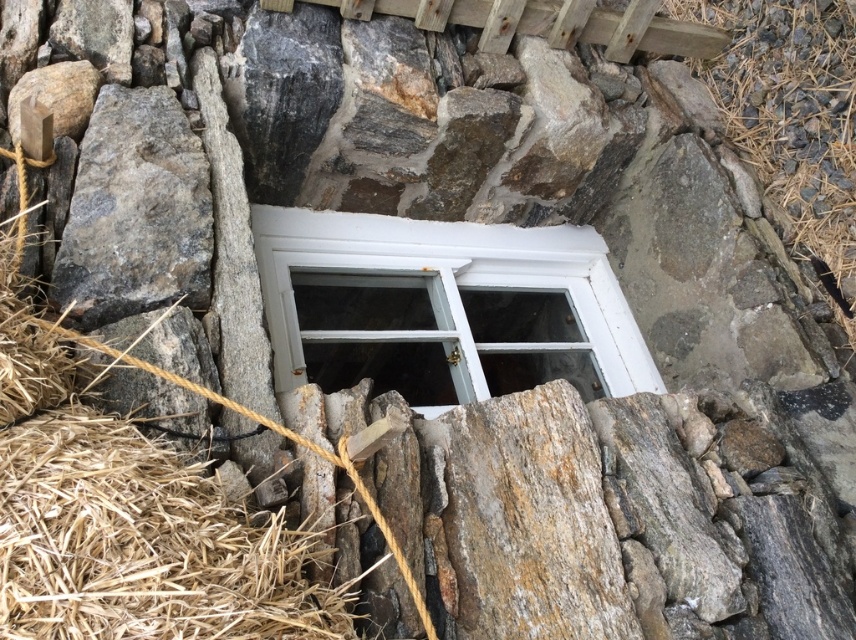
Question: Is brown straw at lower left further to camera compared to gray rough stone at left?

Choices:
 (A) yes
 (B) no

Answer: (B)

Question: Which of the following is the farthest from the observer?

Choices:
 (A) white painted wood window at center
 (B) brown straw at lower left

Answer: (A)

Question: Does brown straw at lower left appear under gray rough stone at left?

Choices:
 (A) no
 (B) yes

Answer: (B)

Question: Is white painted wood window at center bigger than gray rough stone at left?

Choices:
 (A) no
 (B) yes

Answer: (B)

Question: Which is farther from the brown straw at lower left?

Choices:
 (A) white painted wood window at center
 (B) gray rough stone at left

Answer: (A)

Question: Which point is farther to the camera?

Choices:
 (A) (155, 532)
 (B) (51, 296)

Answer: (B)